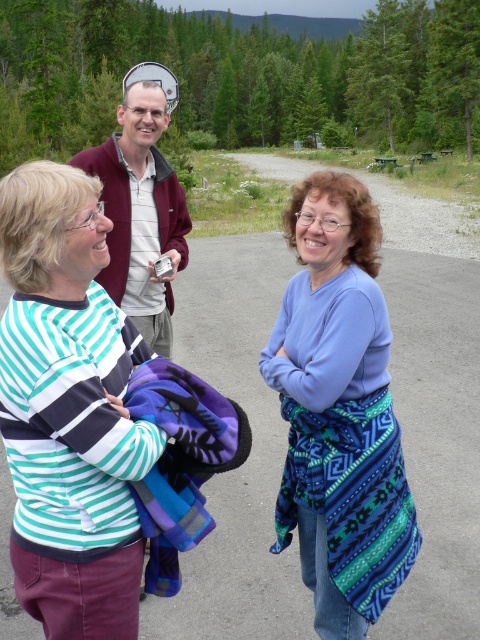
Does striped cotton shirt at left have a lesser height compared to maroon fleece jacket at upper center?

Yes, striped cotton shirt at left is shorter than maroon fleece jacket at upper center.

Is point (112, 602) in front of point (142, 230)?

That is True.

Who is more distant from viewer, (x=84, y=500) or (x=143, y=138)?

The point (x=143, y=138) is behind.

At what (x,y) coordinates should I click in order to perform the action: click on striped cotton shirt at left. Please return your answer as a coordinate pair (x, y). The image size is (480, 640). Looking at the image, I should click on (69, 410).

Is blue woven shawl at center further to the viewer compared to maroon fleece jacket at upper center?

No.

Is point (398, 515) more distant than point (175, 241)?

That is False.

Identify the location of blue woven shawl at center. (338, 410).

Can you confirm if striped cotton shirt at left is positioned to the right of blue woven shawl at center?

No, striped cotton shirt at left is not to the right of blue woven shawl at center.

Between point (135, 460) and point (299, 282), which one is positioned behind?

The point (299, 282) is more distant.

The height and width of the screenshot is (640, 480). In order to click on striped cotton shirt at left in this screenshot , I will do `click(69, 410)`.